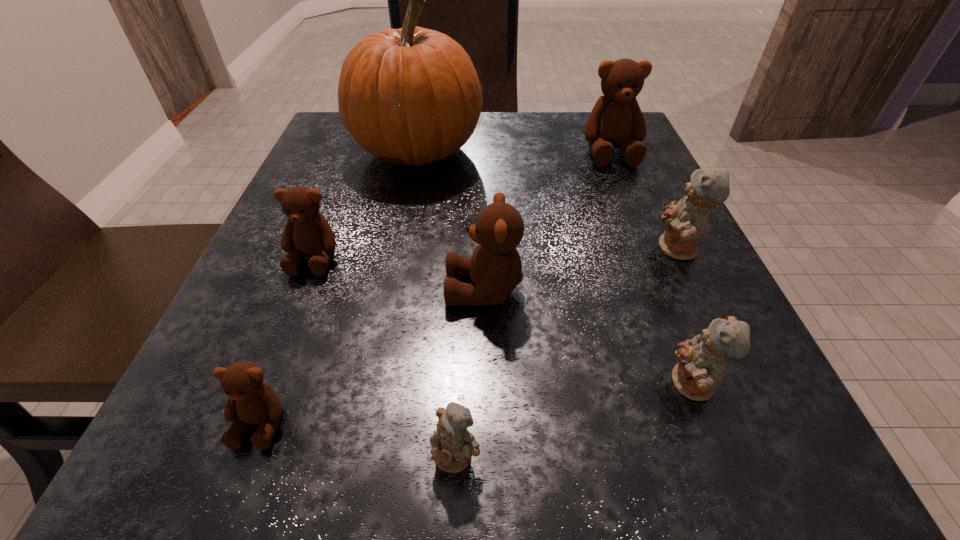
At what (x,y) coordinates should I click in order to perform the action: click on vacant area that lies between the second biggest blue teddy bear and the nearest brown teddy bear. Please return your answer as a coordinate pair (x, y). The height and width of the screenshot is (540, 960). Looking at the image, I should click on (477, 404).

Locate an element on the screen. Image resolution: width=960 pixels, height=540 pixels. vacant area that lies between the second smallest blue teddy bear and the orange pumpkin is located at coordinates (555, 268).

This screenshot has width=960, height=540. In order to click on vacant space that's between the nearest blue teddy bear and the second tallest object in this screenshot , I will do `click(534, 305)`.

This screenshot has width=960, height=540. Identify the location of unoccupied area between the farthest teddy bear and the nearest blue teddy bear. (534, 305).

Identify the location of free space between the pumpkin and the second blue teddy bear from right to left. (555, 268).

This screenshot has height=540, width=960. Identify the location of empty space that is in between the second biggest brown teddy bear and the smallest blue teddy bear. (470, 373).

Identify the location of vacant space that's between the second biggest brown teddy bear and the third biggest brown teddy bear. This screenshot has width=960, height=540. (399, 274).

This screenshot has width=960, height=540. Identify the location of the sixth closest object relative to the leftmost blue teddy bear. (411, 96).

Locate an element on the screen. the seventh closest object to the third biggest brown teddy bear is located at coordinates (685, 222).

Locate an element on the screen. The image size is (960, 540). teddy bear identified as the fourth closest to the orange pumpkin is located at coordinates (685, 222).